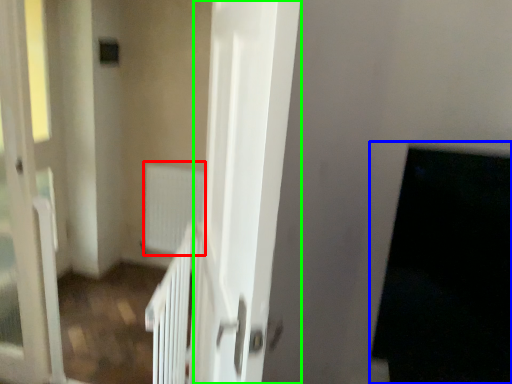
Question: Which object is the closest to the radiator (highlighted by a red box)? Choose among these: dark (highlighted by a blue box) or screen door (highlighted by a green box).

Choices:
 (A) dark
 (B) screen door

Answer: (B)